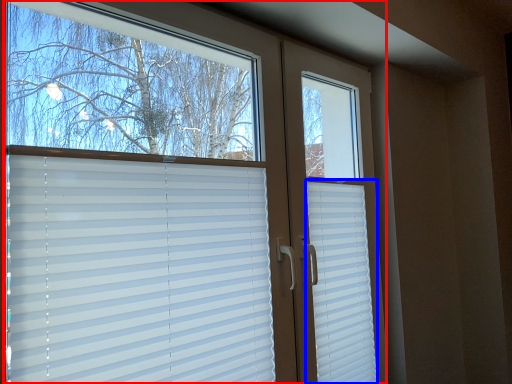
Question: Among these objects, which one is farthest to the camera, window (highlighted by a red box) or shutter (highlighted by a blue box)?

Choices:
 (A) window
 (B) shutter

Answer: (B)